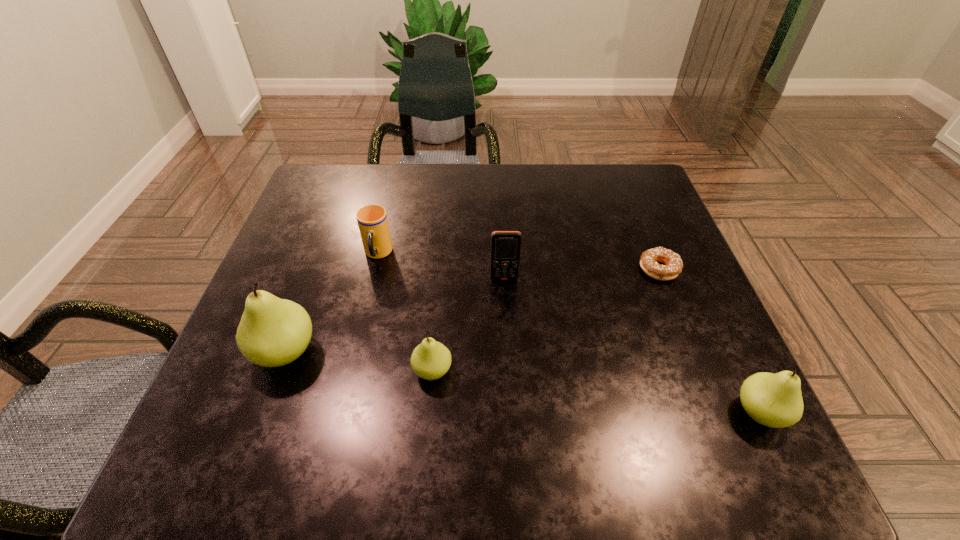
What are the coordinates of `vacant space that satisfies the following two spatial constraints: 1. on the side of the cup with the handle; 2. on the right side of the second tallest pear` in the screenshot? It's located at [341, 412].

Where is `free space that satisfies the following two spatial constraints: 1. on the screen of the second shortest pear; 2. on the right side of the cellular telephone`? This screenshot has height=540, width=960. free space that satisfies the following two spatial constraints: 1. on the screen of the second shortest pear; 2. on the right side of the cellular telephone is located at coordinates (511, 412).

What are the coordinates of `blank area in the image that satisfies the following two spatial constraints: 1. on the side of the shortest object with the handle; 2. on the right side of the fifth object from right to left` in the screenshot? It's located at (374, 269).